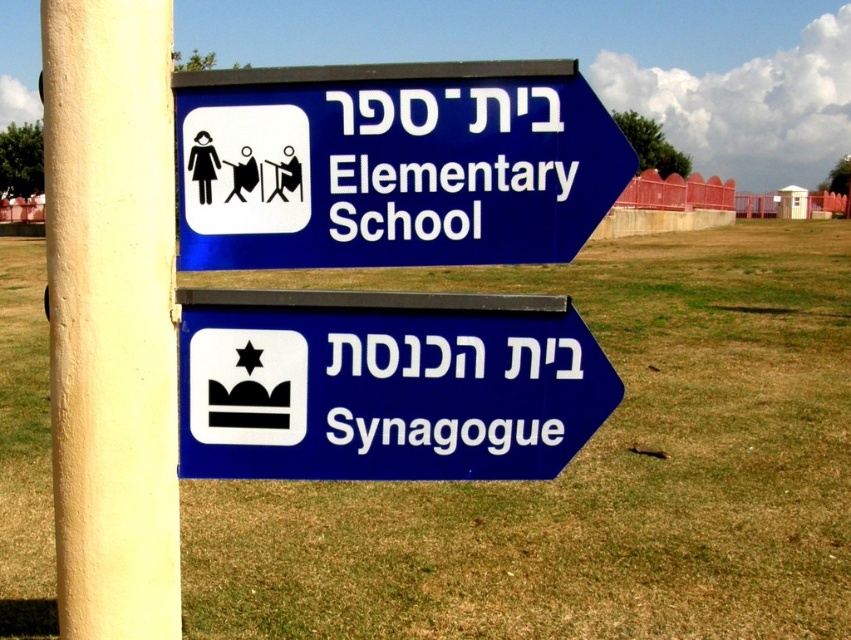
Can you confirm if white textured pole at left is taller than blue plastic sign at lower right?

Yes.

Identify the location of white textured pole at left. (111, 316).

Can you confirm if blue plastic elementary school sign at upper right is positioned below blue plastic sign at lower right?

Actually, blue plastic elementary school sign at upper right is above blue plastic sign at lower right.

Can you confirm if blue plastic elementary school sign at upper right is smaller than blue plastic sign at lower right?

No, blue plastic elementary school sign at upper right is not smaller than blue plastic sign at lower right.

The width and height of the screenshot is (851, 640). Describe the element at coordinates (392, 164) in the screenshot. I see `blue plastic elementary school sign at upper right` at that location.

The width and height of the screenshot is (851, 640). What are the coordinates of `blue plastic elementary school sign at upper right` in the screenshot? It's located at (392, 164).

Between blue plastic elementary school sign at upper right and white textured pole at left, which one is positioned lower?

white textured pole at left

Is blue plastic elementary school sign at upper right positioned at the back of white textured pole at left?

Yes.

Who is more distant from viewer, (423,236) or (92,428)?

The point (423,236) is more distant.

Where is `blue plastic elementary school sign at upper right`? blue plastic elementary school sign at upper right is located at coordinates pyautogui.click(x=392, y=164).